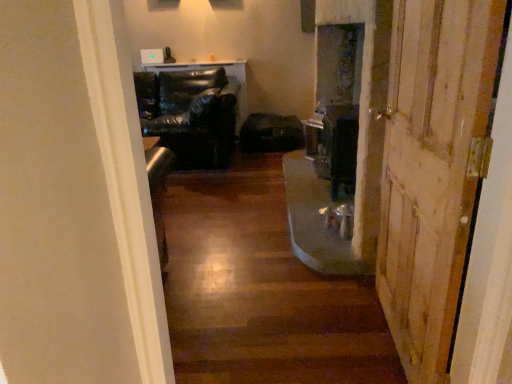
I want to click on vacant space underneath wooden door at right (from a real-world perspective), so click(386, 336).